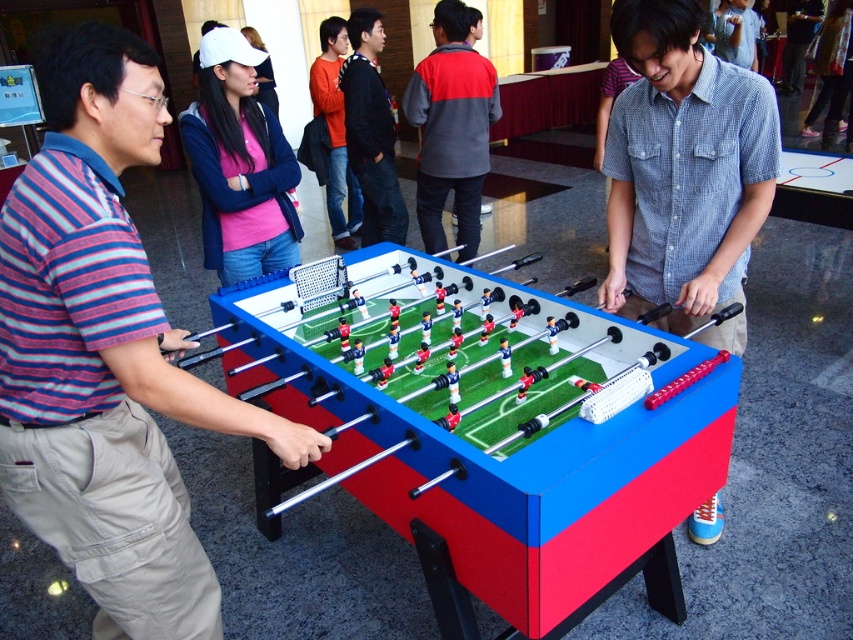
You are a photographer standing at the back of the room and want to take a photo of both the striped cotton shirt at left and the matte pink shirt at upper center in the same frame. The camera you have can capture a maximum distance of 1.5 meters between subjects. Will both shirts be in the same photo?

The distance between the striped cotton shirt at left and the matte pink shirt at upper center is 1.33 meters, which is within the camera maximum distance of 1.5 meters. Therefore, both shirts will be in the same photo.

You are a photographer standing behind the foosball table and want to take a photo that includes both the striped cotton shirt at left and the matte pink shirt at upper center. Which shirt should you position closer to the bottom of the photo frame?

The striped cotton shirt at left is below the matte pink shirt at upper center, so to include both in the photo, position the striped cotton shirt at left closer to the bottom of the photo frame.